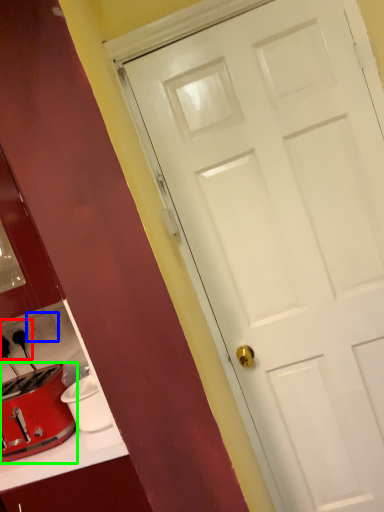
Question: Which is nearer to the electric outlet (highlighted by a red box)? electric outlet (highlighted by a blue box) or toaster (highlighted by a green box).

Choices:
 (A) electric outlet
 (B) toaster

Answer: (A)